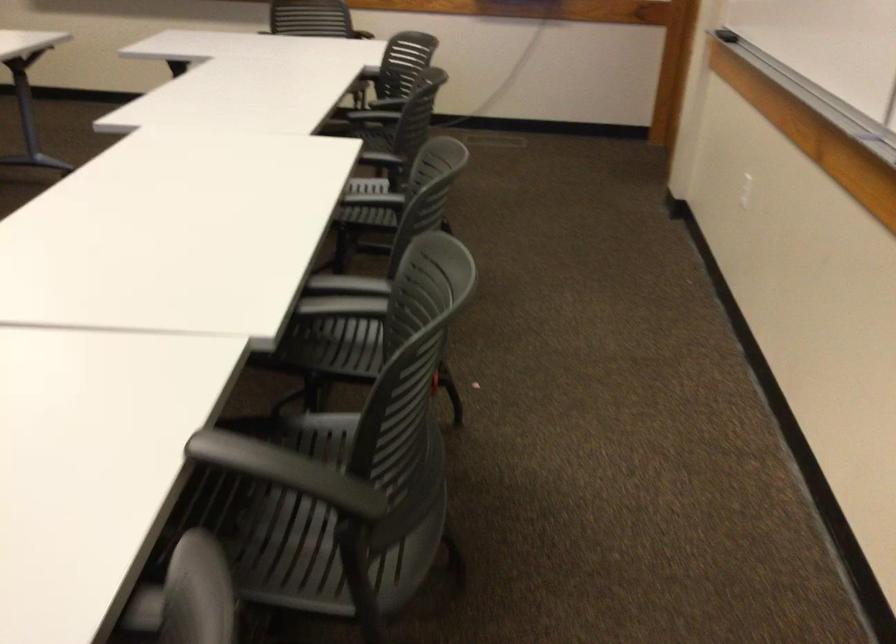
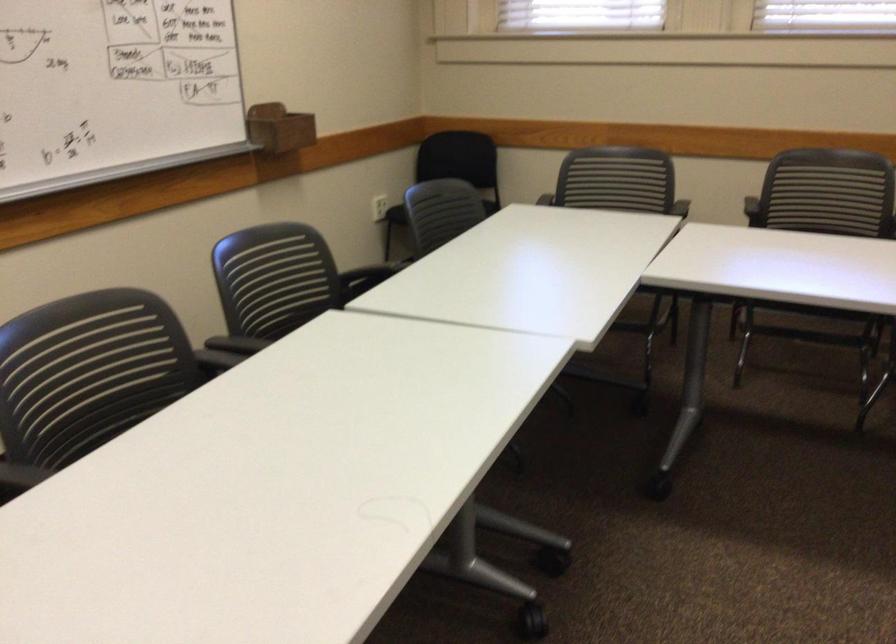
Where in the second image is the point corresponding to point (409, 411) from the first image?

(276, 277)